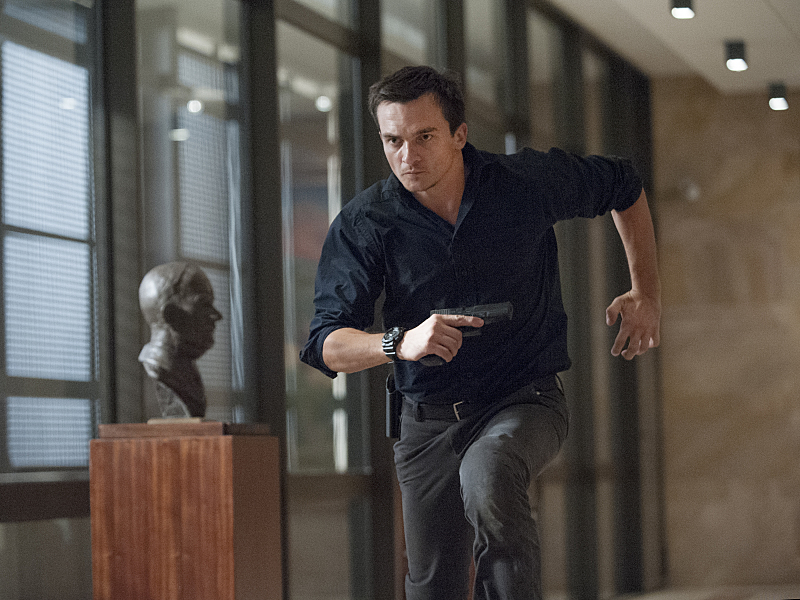
Locate an element on the screen. The image size is (800, 600). overhead light is located at coordinates (681, 15), (733, 60), (781, 102).